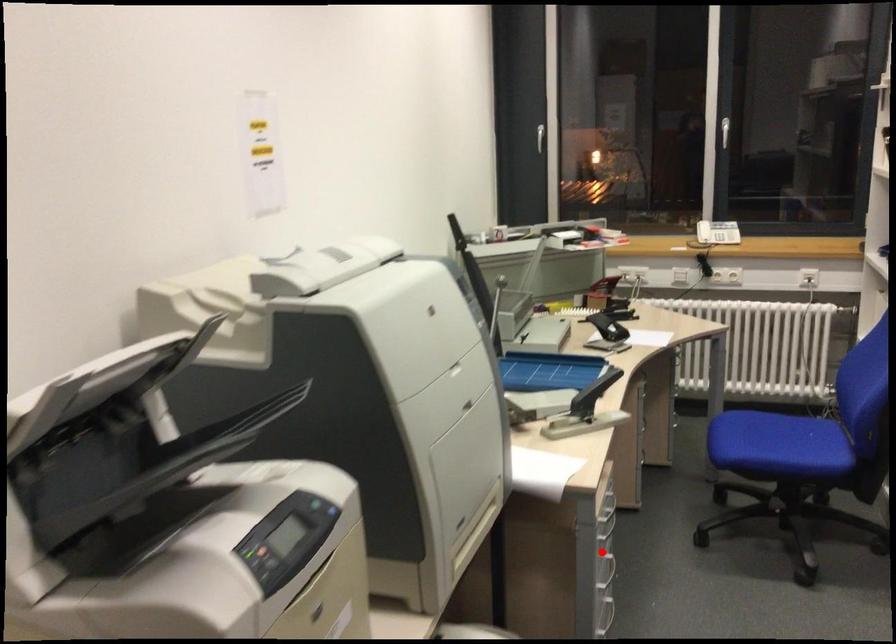
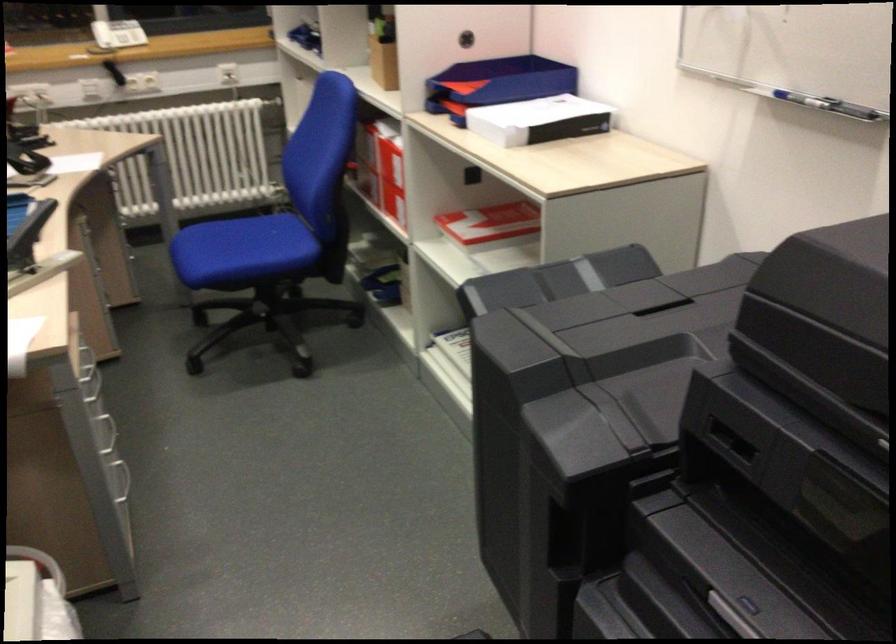
Question: I am providing you with two images of the same scene from different viewpoints. A red point is shown in image1. For the corresponding object point in image2, is it positioned nearer or farther from the camera?

Choices:
 (A) Nearer
 (B) Farther

Answer: (A)